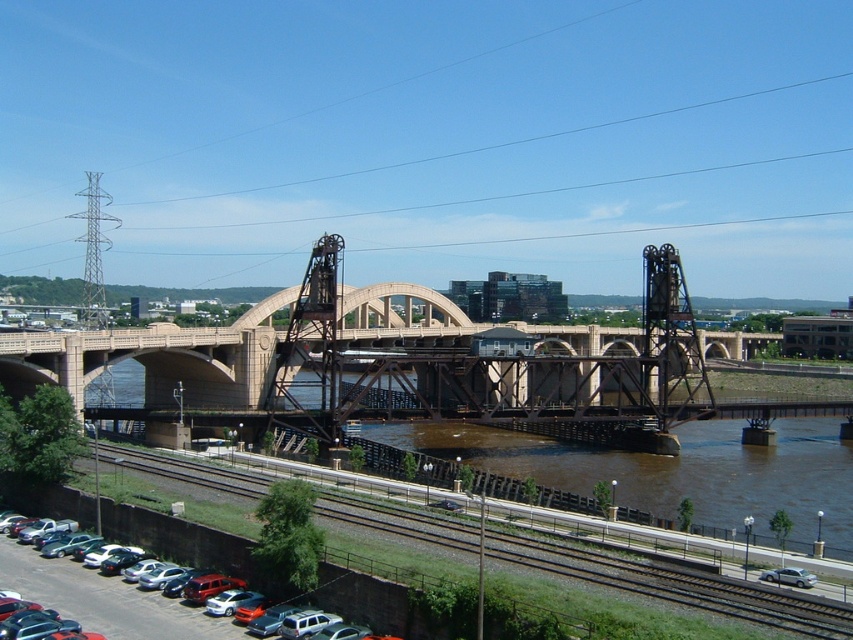
Question: Estimate the real-world distances between objects in this image. Which object is closer to the silver metallic sedan at lower right?

Choices:
 (A) smooth asphalt train track at lower left
 (B) silver metallic sedan at lower left

Answer: (A)

Question: Which point is farther to the camera?

Choices:
 (A) (166, 600)
 (B) (532, 540)

Answer: (B)

Question: Is smooth asphalt train track at lower left thinner than silver metallic sedan at lower left?

Choices:
 (A) no
 (B) yes

Answer: (A)

Question: Is silver metallic sedan at lower left to the right of silver metallic sedan at lower right from the viewer's perspective?

Choices:
 (A) no
 (B) yes

Answer: (A)

Question: Can you confirm if silver metallic sedan at lower left is thinner than silver metallic sedan at lower right?

Choices:
 (A) no
 (B) yes

Answer: (A)

Question: Estimate the real-world distances between objects in this image. Which object is farther from the smooth asphalt train track at lower left?

Choices:
 (A) silver metallic sedan at lower right
 (B) silver metallic sedan at lower left

Answer: (A)